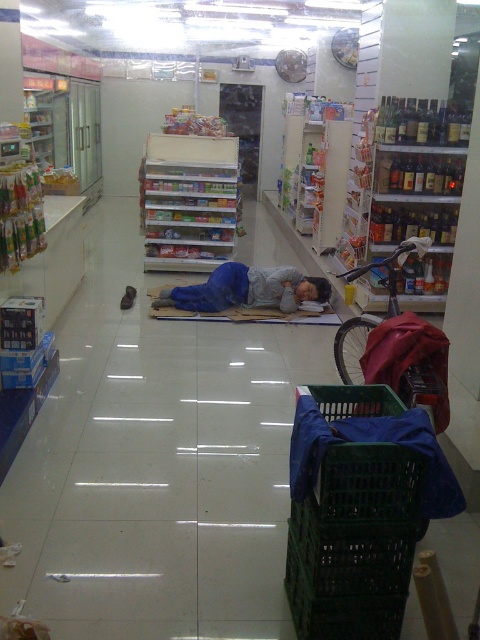
Can you confirm if green plastic crate at lower right is positioned above green plastic shopping cart at center-right?

Incorrect, green plastic crate at lower right is not positioned above green plastic shopping cart at center-right.

Where is `green plastic crate at lower right`? This screenshot has height=640, width=480. green plastic crate at lower right is located at coordinates (355, 541).

Which is more to the right, green plastic crate at lower right or blue fabric sleeping bag at center?

Positioned to the right is green plastic crate at lower right.

Is point (399, 609) closer to viewer compared to point (271, 269)?

Yes.

In order to click on green plastic crate at lower right in this screenshot , I will do `click(355, 541)`.

Between green plastic shopping cart at center-right and blue fabric sleeping bag at center, which one has more height?

green plastic shopping cart at center-right is taller.

The width and height of the screenshot is (480, 640). I want to click on green plastic shopping cart at center-right, so click(x=399, y=346).